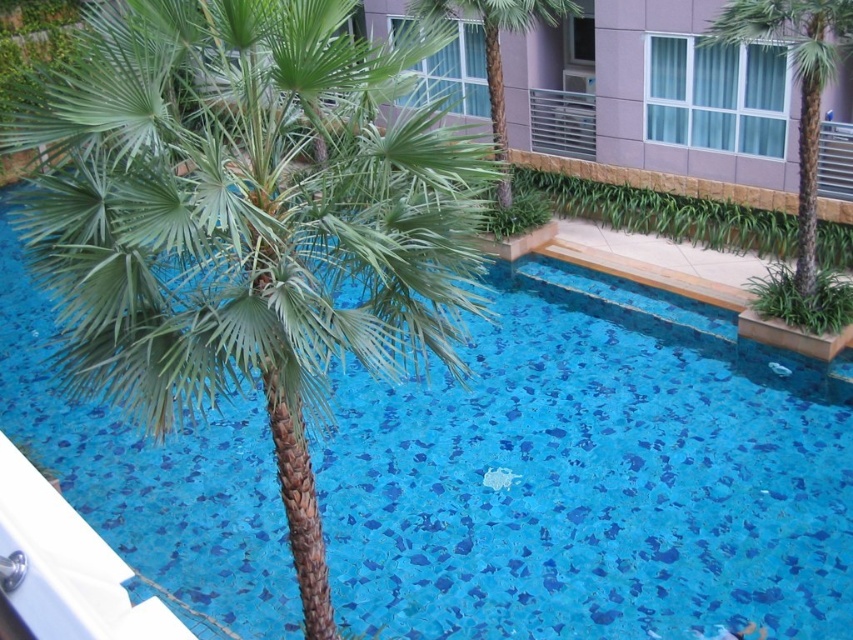
You are standing at the edge of the swimming pool in the image. The point marked as point [584,492] is located where in relation to the palm tree in the foreground?

The point [584,492] corresponds to blue mosaic tiles at center, which are located in the center of the pool, away from the palm tree in the foreground.